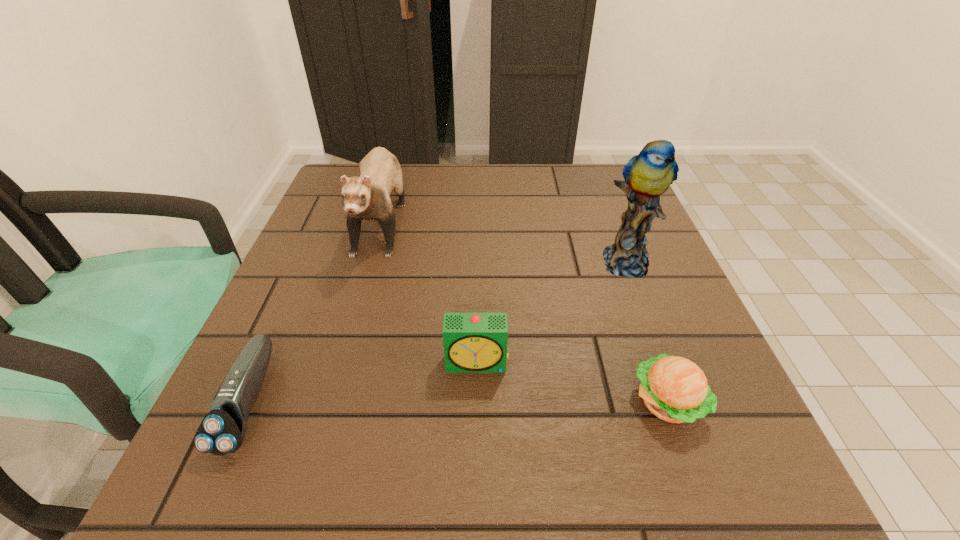
This screenshot has height=540, width=960. In the image, there is a desktop. In order to click on free space at the far edge in this screenshot , I will do `click(448, 166)`.

Where is `vacant area at the near edge of the desktop`? vacant area at the near edge of the desktop is located at coordinates (354, 504).

This screenshot has width=960, height=540. What are the coordinates of `free spot at the left edge of the desktop` in the screenshot? It's located at (313, 261).

Find the location of a particular element. The height and width of the screenshot is (540, 960). free space at the right edge of the desktop is located at coordinates (657, 329).

Image resolution: width=960 pixels, height=540 pixels. In order to click on vacant space at the far left corner in this screenshot , I will do `click(339, 199)`.

This screenshot has height=540, width=960. What are the coordinates of `free space at the near left corner of the desktop` in the screenshot? It's located at (252, 475).

The width and height of the screenshot is (960, 540). I want to click on free spot between the ferret and the shortest object, so click(x=316, y=308).

Where is `vacant space that's between the leftmost object and the second shortest object`? This screenshot has width=960, height=540. vacant space that's between the leftmost object and the second shortest object is located at coordinates (459, 402).

The image size is (960, 540). I want to click on free space between the fourth tallest object and the third shortest object, so click(572, 382).

In order to click on free spot between the third object from right to left and the second shortest object in this screenshot , I will do `click(572, 382)`.